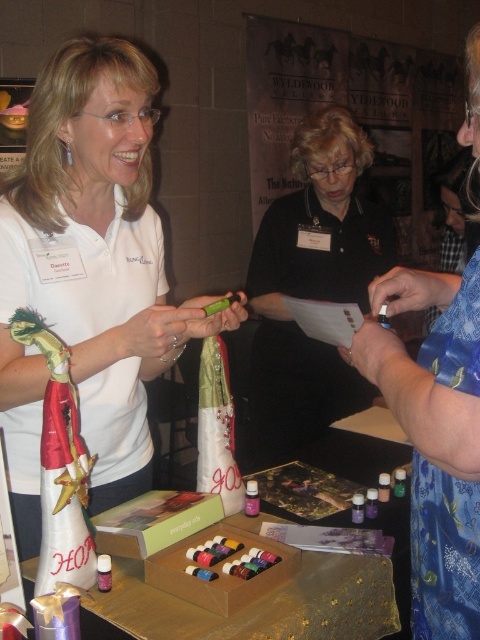
Question: Is purple glass bottle at center above green matte bottle at lower right?

Choices:
 (A) no
 (B) yes

Answer: (B)

Question: Which point is closer to the camera taking this photo?

Choices:
 (A) (374, 493)
 (B) (380, 596)
 (C) (255, 512)
 (D) (387, 497)

Answer: (B)

Question: From the image, what is the correct spatial relationship of black matte pen at center in relation to wooden table at center?

Choices:
 (A) right
 (B) left

Answer: (A)

Question: Estimate the real-world distances between objects in this image. Which object is farther from the white matte shirt at center?

Choices:
 (A) translucent plastic bottle at center
 (B) purple glass bottle at center

Answer: (B)

Question: Which of the following is the farthest from the observer?

Choices:
 (A) purple matte bottle at center
 (B) translucent plastic bottle at center

Answer: (B)

Question: Does blue floral dress at center have a smaller size compared to translucent plastic bottle at center?

Choices:
 (A) yes
 (B) no

Answer: (B)